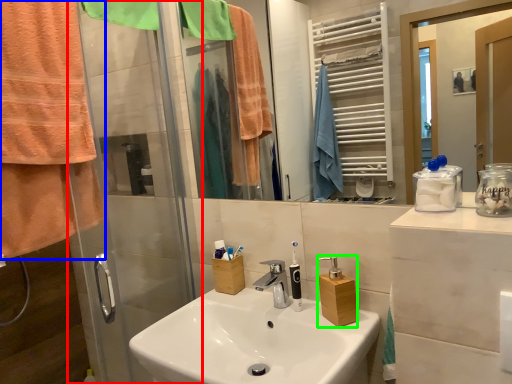
Question: Estimate the real-world distances between objects in this image. Which object is farther from shower door (highlighted by a red box), towel/napkin (highlighted by a blue box) or bottle (highlighted by a green box)?

Choices:
 (A) towel/napkin
 (B) bottle

Answer: (B)